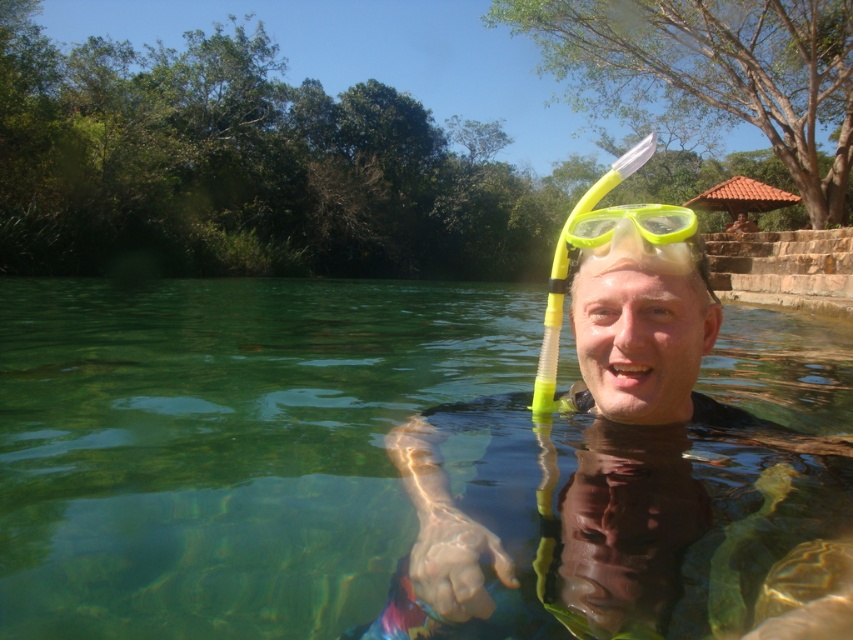
Does point (791, 611) come farther from viewer compared to point (573, 240)?

No, (791, 611) is closer to viewer.

Is yellow matte snorkel at center below yellow rubber goggles at center?

Correct, yellow matte snorkel at center is located below yellow rubber goggles at center.

The height and width of the screenshot is (640, 853). What are the coordinates of `yellow matte snorkel at center` in the screenshot? It's located at (621, 484).

Find the location of a particular element. Image resolution: width=853 pixels, height=640 pixels. yellow matte snorkel at center is located at coordinates (621, 484).

Can you confirm if clear water at center is positioned above yellow rubber goggles at center?

Correct, clear water at center is located above yellow rubber goggles at center.

Is point (149, 444) positioned after point (627, 211)?

That is True.

At what (x,y) coordinates should I click in order to perform the action: click on clear water at center. Please return your answer as a coordinate pair (x, y). Looking at the image, I should click on (387, 467).

Does clear water at center come behind yellow matte snorkel at center?

No.

Between point (357, 369) and point (549, 385), which one is positioned in front?

Point (549, 385) is more forward.

Measure the distance between clear water at center and camera.

38.42 inches

Where is `clear water at center`? This screenshot has height=640, width=853. clear water at center is located at coordinates (387, 467).